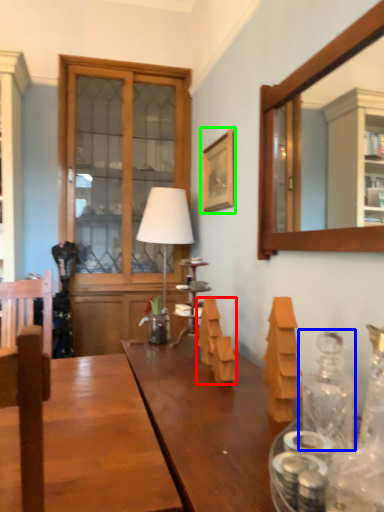
Question: Estimate the real-world distances between objects in this image. Which object is farther from wood (highlighted by a red box), glass jar (highlighted by a blue box) or picture frame (highlighted by a green box)?

Choices:
 (A) glass jar
 (B) picture frame

Answer: (B)